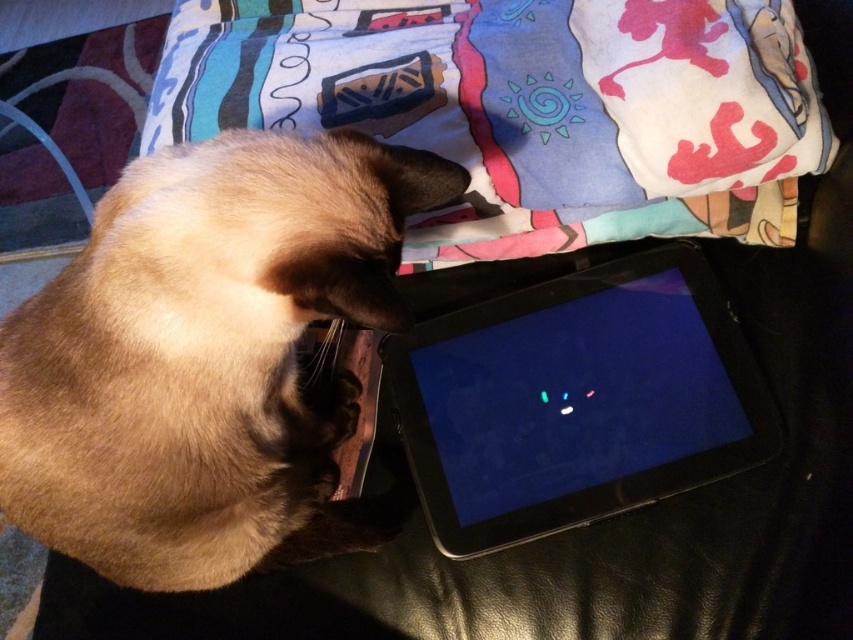
Is satin beige cat at lower left smaller than black matte tablet at center?

No, satin beige cat at lower left is not smaller than black matte tablet at center.

Locate an element on the screen. satin beige cat at lower left is located at coordinates tap(207, 356).

In order to click on satin beige cat at lower left in this screenshot , I will do `click(207, 356)`.

This screenshot has height=640, width=853. I want to click on satin beige cat at lower left, so click(x=207, y=356).

Between point (354, 166) and point (515, 209), which one is positioned in front?

Point (354, 166) is more forward.

Who is taller, satin beige cat at lower left or printed fabric pillow at upper center?

With more height is satin beige cat at lower left.

Is point (70, 492) positioned after point (724, 84)?

No, it is in front of (724, 84).

In order to click on satin beige cat at lower left in this screenshot , I will do click(207, 356).

Who is shorter, printed fabric pillow at upper center or black matte tablet at center?

Standing shorter between the two is black matte tablet at center.

Does printed fabric pillow at upper center lie behind black matte tablet at center?

No, it is in front of black matte tablet at center.

Is point (699, 4) closer to viewer compared to point (537, 481)?

Yes, it is.

The width and height of the screenshot is (853, 640). Find the location of `printed fabric pillow at upper center`. printed fabric pillow at upper center is located at coordinates (525, 108).